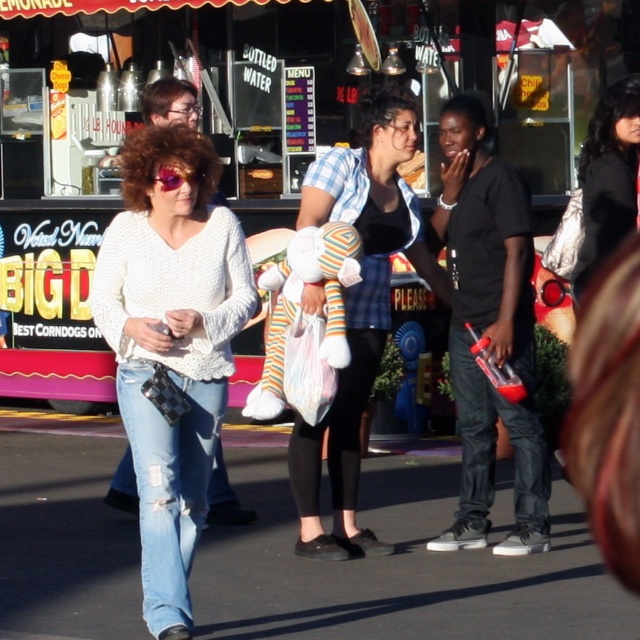
Can you confirm if plaid shirt at center is thinner than denim jeans at lower right?

No, plaid shirt at center is not thinner than denim jeans at lower right.

Is plaid shirt at center wider than denim jeans at lower right?

Yes, plaid shirt at center is wider than denim jeans at lower right.

In order to click on plaid shirt at center in this screenshot , I will do `click(358, 308)`.

Identify the location of plaid shirt at center. (358, 308).

Does black matte shirt at center appear over denim jeans at lower right?

Yes.

Does black matte shirt at center lie behind denim jeans at lower right?

No, it is in front of denim jeans at lower right.

The width and height of the screenshot is (640, 640). I want to click on black matte shirt at center, so click(x=490, y=330).

Does point (134, 458) come behind point (637, 104)?

No, it is not.

Can you confirm if ripped denim jeans at lower left is wider than black hair at center?

Correct, the width of ripped denim jeans at lower left exceeds that of black hair at center.

Which is in front, point (184, 616) or point (596, 243)?

Point (184, 616) is in front.

This screenshot has height=640, width=640. I want to click on ripped denim jeans at lower left, so click(170, 484).